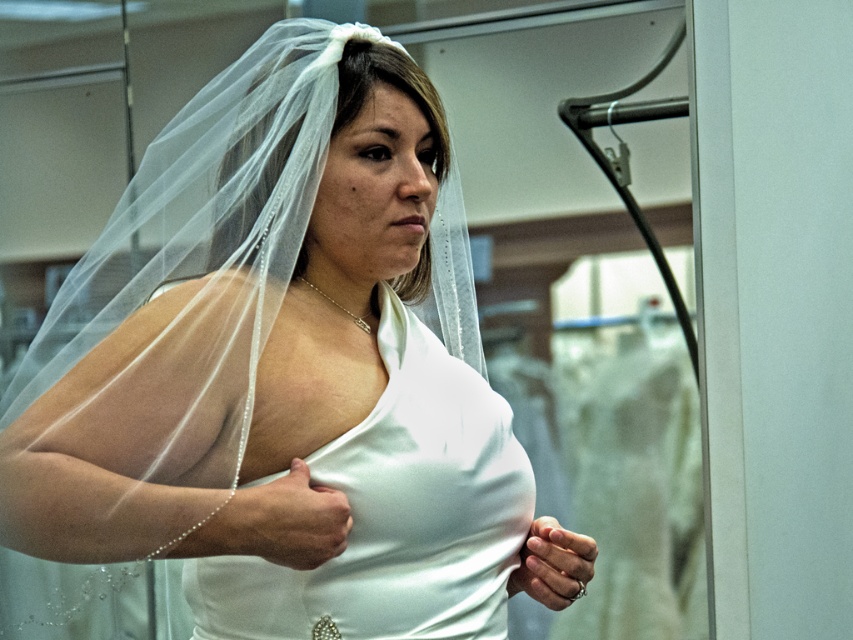
How much distance is there between white satin dress at center and white satin gown at center?

4.18 centimeters

Is white satin dress at center in front of white satin gown at center?

That is True.

Is point (309, 337) positioned after point (357, 538)?

Yes, point (309, 337) is behind point (357, 538).

I want to click on white satin dress at center, so click(280, 376).